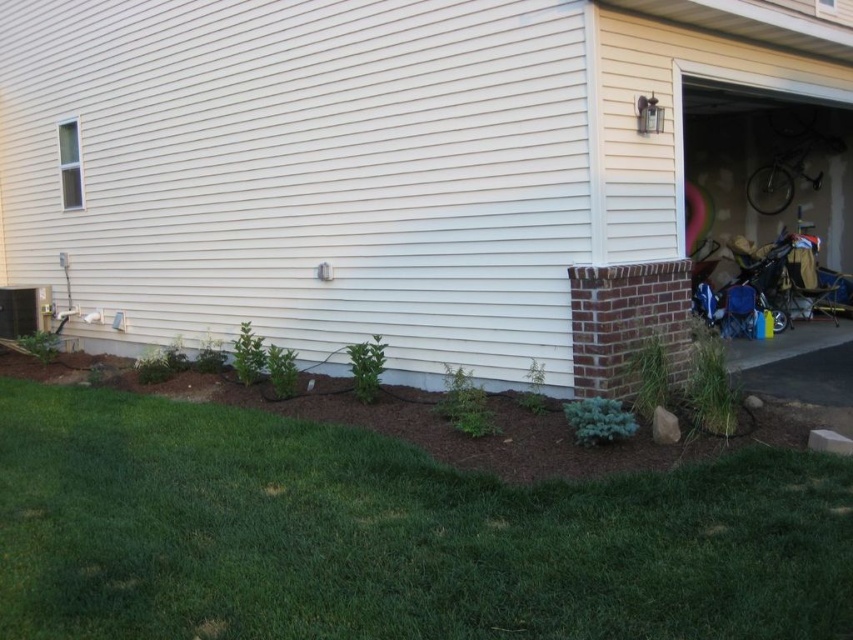
Can you confirm if matte white garage at center is positioned above green grass at lower left?

Yes.

Is matte white garage at center below green grass at lower left?

No, matte white garage at center is not below green grass at lower left.

Is point (337, 212) in front of point (810, 538)?

No, (337, 212) is behind (810, 538).

Locate an element on the screen. This screenshot has height=640, width=853. matte white garage at center is located at coordinates (413, 170).